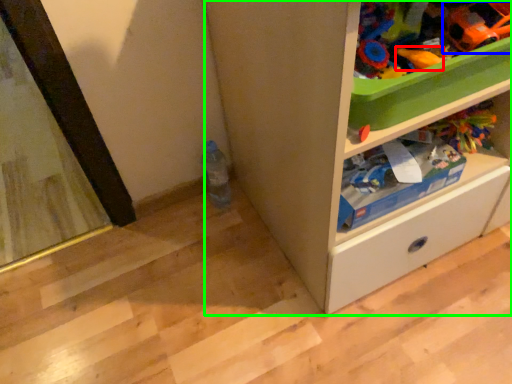
Question: Considering the real-world distances, which object is closest to toy (highlighted by a red box)? toy (highlighted by a blue box) or cabinetry (highlighted by a green box).

Choices:
 (A) toy
 (B) cabinetry

Answer: (A)